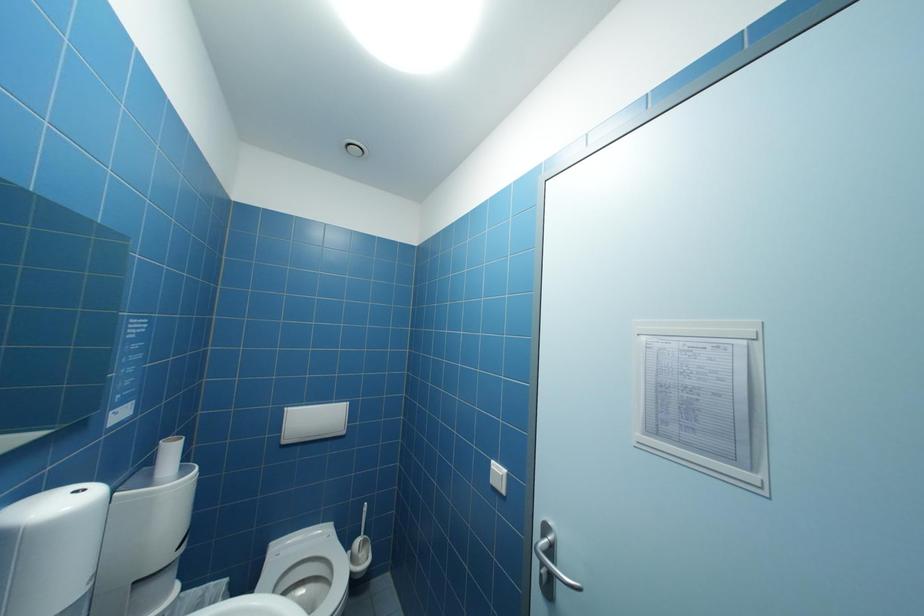
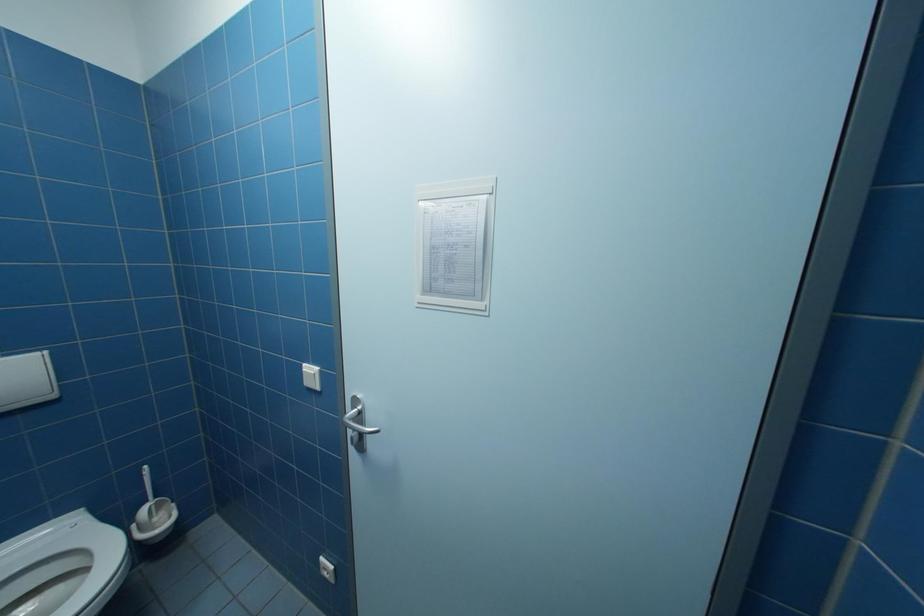
How did the camera likely rotate?

The rotation direction of the camera is right-down.